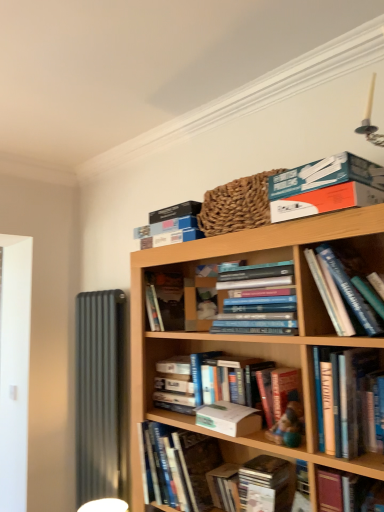
Locate an element on the screen. Image resolution: width=384 pixels, height=512 pixels. hardcover books at center, the 6th book from the bottom is located at coordinates (258, 300).

Describe the element at coordinates (258, 300) in the screenshot. The image size is (384, 512). I see `hardcover books at center, the 6th book from the bottom` at that location.

In order to face blue cardboard box at upper center, which is the eighth book in bottom-to-top order, should I rotate leftwards or rightwards?

You should rotate left by 1.017 degrees.

This screenshot has height=512, width=384. Describe the element at coordinates (229, 418) in the screenshot. I see `white paper at center, arranged as the first paperback book when ordered from the bottom` at that location.

Locate an element on the screen. This screenshot has height=512, width=384. white paper at center, positioned as the 1th paperback book in front-to-back order is located at coordinates (229, 418).

Measure the distance between point (325, 166) and camera.

Point (325, 166) is 1.20 meters away from camera.

Identify the location of hardcover book at lower right, the 7th book from the top. This screenshot has width=384, height=512. (341, 490).

Is white paper at center, positioned as the 1th paperback book in front-to-back order, not near blue matte paperback book at upper center, which ranks as the second paperback book in bottom-to-top order?

white paper at center, positioned as the 1th paperback book in front-to-back order, is near blue matte paperback book at upper center, which ranks as the second paperback book in bottom-to-top order, not far away.

At what (x,y) coordinates should I click in order to perform the action: click on paperback book that appears on the left of white paper at center, positioned as the 1th paperback book in front-to-back order. Please return your answer as a coordinate pair (x, y). The height and width of the screenshot is (512, 384). Looking at the image, I should click on (175, 211).

Is white paper at center, which is counted as the 2th paperback book, starting from the top, smaller than blue matte paperback book at upper center, the 1th paperback book in the back-to-front sequence?

Yes, white paper at center, which is counted as the 2th paperback book, starting from the top, is smaller than blue matte paperback book at upper center, the 1th paperback book in the back-to-front sequence.

From a real-world perspective, between white paper at center, which is counted as the 2th paperback book, starting from the top, and blue matte paperback book at upper center, which ranks as the second paperback book in bottom-to-top order, who is vertically lower?

In real-world perspective, white paper at center, which is counted as the 2th paperback book, starting from the top, is lower.

From a real-world perspective, is hardcover book at lower right, the 7th book from the top, below wooden cd case at lower center, marked as the ninth book in a top-to-bottom arrangement?

No.

There is a wooden cd case at lower center, the first book when ordered from bottom to top. In order to click on the 2nd book above it (from the image's perspective) in this screenshot , I will do `click(341, 490)`.

Considering the sizes of hardcover book at lower right, the 7th book from the top, and wooden cd case at lower center, marked as the ninth book in a top-to-bottom arrangement, in the image, is hardcover book at lower right, the 7th book from the top, bigger or smaller than wooden cd case at lower center, marked as the ninth book in a top-to-bottom arrangement,?

Clearly, hardcover book at lower right, the 7th book from the top, is larger in size than wooden cd case at lower center, marked as the ninth book in a top-to-bottom arrangement.

From a real-world perspective, which object rests below the other?

white paper at center, positioned as the 1th paperback book in front-to-back order, is physically lower.

How different are the orientations of blue cardboard box at upper center, the ninth book from the bottom, and white paper at center, the second paperback book positioned from the back, in degrees?

They differ by 0.781 degrees in their facing directions.

From the image's perspective, is blue cardboard box at upper center, which ranks as the 1th book in top-to-bottom order, positioned above or below white paper at center, which is counted as the 2th paperback book, starting from the top?

Based on their image positions, blue cardboard box at upper center, which ranks as the 1th book in top-to-bottom order, is located above white paper at center, which is counted as the 2th paperback book, starting from the top.

Which object is more forward, blue cardboard box at upper center, the ninth book from the bottom, or white paper at center, positioned as the 1th paperback book in front-to-back order?

blue cardboard box at upper center, the ninth book from the bottom, is more forward.

Is the surface of hardcover book at center, which is counted as the 4th book, starting from the bottom, in direct contact with hardcover book at center, arranged as the eighth book when viewed from the top?

No, hardcover book at center, which is counted as the 4th book, starting from the bottom, is not beside hardcover book at center, arranged as the eighth book when viewed from the top.

Considering the relative sizes of hardcover book at center, which ranks as the 6th book in top-to-bottom order, and hardcover book at center, acting as the second book starting from the bottom, in the image provided, is hardcover book at center, which ranks as the 6th book in top-to-bottom order, shorter than hardcover book at center, acting as the second book starting from the bottom,?

Yes, hardcover book at center, which ranks as the 6th book in top-to-bottom order, is shorter than hardcover book at center, acting as the second book starting from the bottom.

Is hardcover book at center, which ranks as the 6th book in top-to-bottom order, wider than hardcover book at center, arranged as the eighth book when viewed from the top?

Incorrect, the width of hardcover book at center, which ranks as the 6th book in top-to-bottom order, does not surpass that of hardcover book at center, arranged as the eighth book when viewed from the top.

Is hardcover book at center, which ranks as the 6th book in top-to-bottom order, inside the boundaries of hardcover book at center, arranged as the eighth book when viewed from the top, or outside?

hardcover book at center, which ranks as the 6th book in top-to-bottom order, is not enclosed by hardcover book at center, arranged as the eighth book when viewed from the top.

From a real-world perspective, relative to blue cardboard box at upper center, which ranks as the 1th book in top-to-bottom order, is blue cardboard box at upper center, which is the eighth book in bottom-to-top order, vertically above or below?

Clearly, from a real-world perspective, blue cardboard box at upper center, which is the eighth book in bottom-to-top order, is below blue cardboard box at upper center, which ranks as the 1th book in top-to-bottom order.

What's the angular difference between blue cardboard box at upper center, the 2th book from the top, and blue cardboard box at upper center, the ninth book from the bottom,'s facing directions?

4.25 degrees.

Who is bigger, blue cardboard box at upper center, the 2th book from the top, or blue cardboard box at upper center, the ninth book from the bottom?

blue cardboard box at upper center, the ninth book from the bottom.

How distant is blue cardboard box at upper center, the 2th book from the top, from blue cardboard box at upper center, which ranks as the 1th book in top-to-bottom order?

blue cardboard box at upper center, the 2th book from the top, is 20.36 inches away from blue cardboard box at upper center, which ranks as the 1th book in top-to-bottom order.

From a real-world perspective, which is physically below, wooden cd case at lower center, marked as the ninth book in a top-to-bottom arrangement, or white paper at center, arranged as the first paperback book when ordered from the bottom?

wooden cd case at lower center, marked as the ninth book in a top-to-bottom arrangement.

Are wooden cd case at lower center, the first book when ordered from bottom to top, and white paper at center, the second paperback book positioned from the back, beside each other?

No.

Is wooden cd case at lower center, the first book when ordered from bottom to top, behind white paper at center, positioned as the 1th paperback book in front-to-back order?

Yes, wooden cd case at lower center, the first book when ordered from bottom to top, is further from the viewer.

What's the angular difference between wooden cd case at lower center, the first book when ordered from bottom to top, and white paper at center, which is counted as the 2th paperback book, starting from the top,'s facing directions?

The facing directions of wooden cd case at lower center, the first book when ordered from bottom to top, and white paper at center, which is counted as the 2th paperback book, starting from the top, are 10.8 degrees apart.

From a real-world perspective, is blue cardboard box at upper center, which is the eighth book in bottom-to-top order, above or below white paper at center, arranged as the first paperback book when ordered from the bottom?

blue cardboard box at upper center, which is the eighth book in bottom-to-top order, is situated higher than white paper at center, arranged as the first paperback book when ordered from the bottom, in the real world.

Would you say blue cardboard box at upper center, which is the eighth book in bottom-to-top order, is outside white paper at center, which is counted as the 2th paperback book, starting from the top?

That's correct, blue cardboard box at upper center, which is the eighth book in bottom-to-top order, is outside of white paper at center, which is counted as the 2th paperback book, starting from the top.

In the image, is blue cardboard box at upper center, the 2th book from the top, on the left side or the right side of white paper at center, the second paperback book positioned from the back?

From the image, it's evident that blue cardboard box at upper center, the 2th book from the top, is to the left of white paper at center, the second paperback book positioned from the back.

From the image's perspective, between blue cardboard box at upper center, the 2th book from the top, and white paper at center, the second paperback book positioned from the back, which one is located above?

From the image's view, blue cardboard box at upper center, the 2th book from the top, is above.

Identify the location of paperback book below the blue matte paperback book at upper center, arranged as the 2th paperback book when viewed from the front (from the image's perspective). The height and width of the screenshot is (512, 384). (229, 418).

This screenshot has height=512, width=384. I want to click on the 4th book counting from the right side of the wooden cd case at lower center, the first book when ordered from bottom to top, so click(x=341, y=490).

Looking at this image, which object lies further to the anchor point blue matte paperback book at upper center, which ranks as the second paperback book in bottom-to-top order, hardcover book at center, which ranks as the 6th book in top-to-bottom order, or wooden cd case at lower center, marked as the ninth book in a top-to-bottom arrangement?

wooden cd case at lower center, marked as the ninth book in a top-to-bottom arrangement, is positioned further to the anchor blue matte paperback book at upper center, which ranks as the second paperback book in bottom-to-top order.

When comparing their distances from blue matte paperback book at upper center, arranged as the 2th paperback book when viewed from the front, does hardcover book at upper center, the seventh book ordered from the bottom, or white paper at center, which is counted as the 2th paperback book, starting from the top, seem closer?

hardcover book at upper center, the seventh book ordered from the bottom, is positioned closer to the anchor blue matte paperback book at upper center, arranged as the 2th paperback book when viewed from the front.

When comparing their distances from hardcover book at lower right, the 7th book from the top, does blue matte paperback book at upper center, which ranks as the second paperback book in bottom-to-top order, or blue cardboard box at upper center, the 2th book from the top, seem closer?

Among the two, blue cardboard box at upper center, the 2th book from the top, is located nearer to hardcover book at lower right, the 7th book from the top.

When comparing their distances from hardcover book at center, which ranks as the 5th book in top-to-bottom order, does hardcover book at lower right, the third book ordered from the bottom, or blue cardboard box at upper center, which ranks as the 1th book in top-to-bottom order, seem further?

hardcover book at lower right, the third book ordered from the bottom, is positioned further to the anchor hardcover book at center, which ranks as the 5th book in top-to-bottom order.

When comparing their distances from white paper at center, the second paperback book positioned from the back, does hardcover book at upper center, the third book from the top, or blue matte paperback book at upper center, which ranks as the second paperback book in bottom-to-top order, seem further?

blue matte paperback book at upper center, which ranks as the second paperback book in bottom-to-top order, is further to white paper at center, the second paperback book positioned from the back.

Looking at the image, which one is located closer to blue cardboard box at upper center, the ninth book from the bottom, hardcover book at upper center, the seventh book ordered from the bottom, or hardcover book at center, acting as the second book starting from the bottom?

hardcover book at upper center, the seventh book ordered from the bottom, lies closer to blue cardboard box at upper center, the ninth book from the bottom, than the other object.

Which object lies nearer to the anchor point hardcover book at upper center, the seventh book ordered from the bottom, blue cardboard box at upper center, the ninth book from the bottom, or hardcover book at center, which ranks as the 5th book in top-to-bottom order?

blue cardboard box at upper center, the ninth book from the bottom, is positioned closer to the anchor hardcover book at upper center, the seventh book ordered from the bottom.

Which object lies further to the anchor point white paper at center, which is counted as the 2th paperback book, starting from the top, hardcover book at center, which is counted as the 4th book, starting from the bottom, or blue matte paperback book at upper center, which ranks as the second paperback book in bottom-to-top order?

Based on the image, blue matte paperback book at upper center, which ranks as the second paperback book in bottom-to-top order, appears to be further to white paper at center, which is counted as the 2th paperback book, starting from the top.

Where is `paperback book between blue cardboard box at upper center, the ninth book from the bottom, and hardcover book at center, which is counted as the 4th book, starting from the bottom, vertically`? Image resolution: width=384 pixels, height=512 pixels. paperback book between blue cardboard box at upper center, the ninth book from the bottom, and hardcover book at center, which is counted as the 4th book, starting from the bottom, vertically is located at coordinates (175, 211).

Identify the location of paperback book between blue cardboard box at upper center, the 2th book from the top, and hardcover book at center, acting as the second book starting from the bottom, from top to bottom. This screenshot has width=384, height=512. [x=229, y=418].

Locate an element on the screen. Image resolution: width=384 pixels, height=512 pixels. paperback book between blue matte paperback book at upper center, which ranks as the second paperback book in bottom-to-top order, and wooden cd case at lower center, marked as the ninth book in a top-to-bottom arrangement, from top to bottom is located at coordinates (229, 418).

I want to click on paperback book between hardcover book at center, which is counted as the 4th book, starting from the bottom, and wooden cd case at lower center, marked as the ninth book in a top-to-bottom arrangement, in the vertical direction, so click(x=229, y=418).